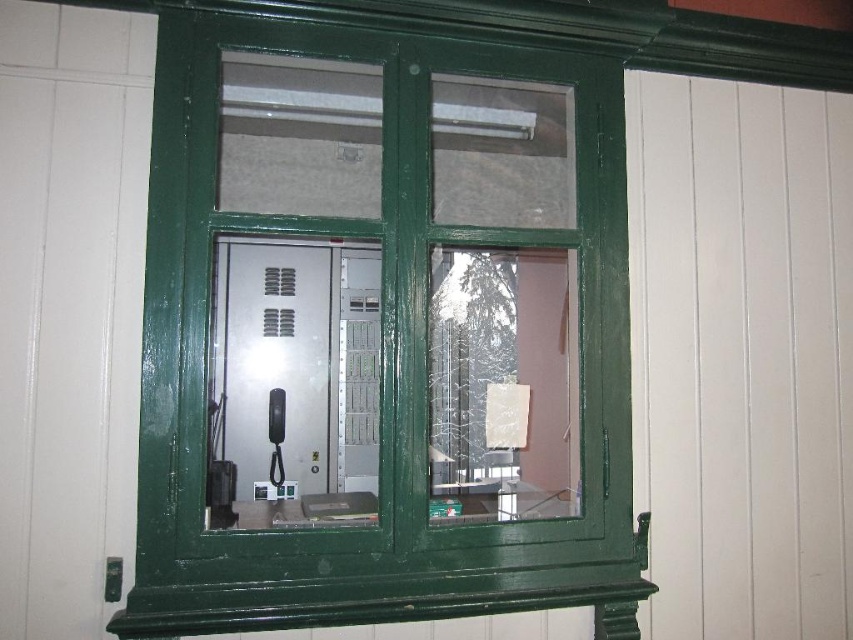
What object is located at the coordinates point (384,332)?

The green painted wood at center is located at point (384,332).

You are an interior designer assessing the space in the image. You need to place a decorative item that requires a surface area of 1 square meter. Which object, the green painted wood at center or the white matte curtain at right, would be more suitable for placing this item?

The green painted wood at center has a larger size compared to the white matte curtain at right, making it more suitable for placing the decorative item requiring 1 square meter of surface area.